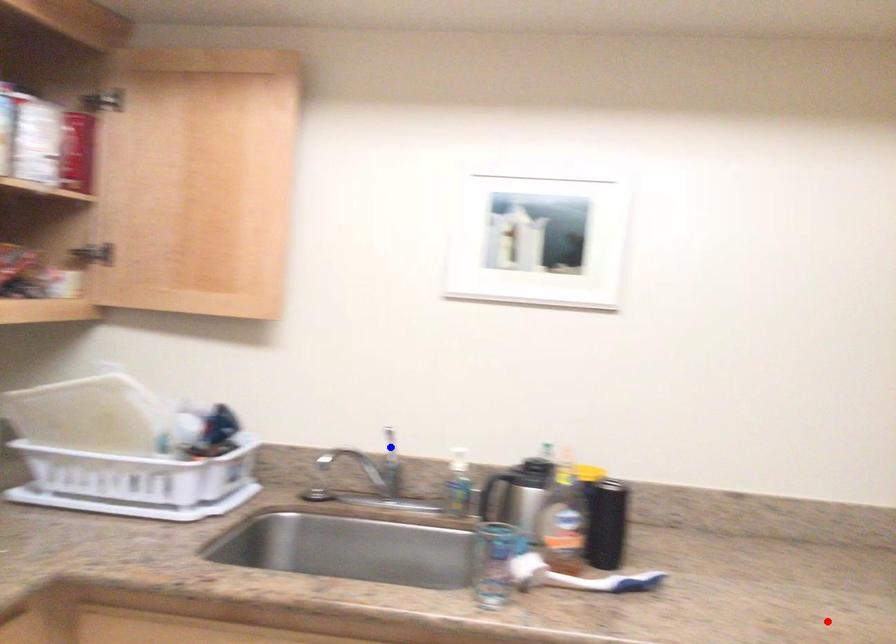
Question: Two points are marked on the image. Which point is closer to the camera?

Choices:
 (A) Blue point is closer.
 (B) Red point is closer.

Answer: (B)